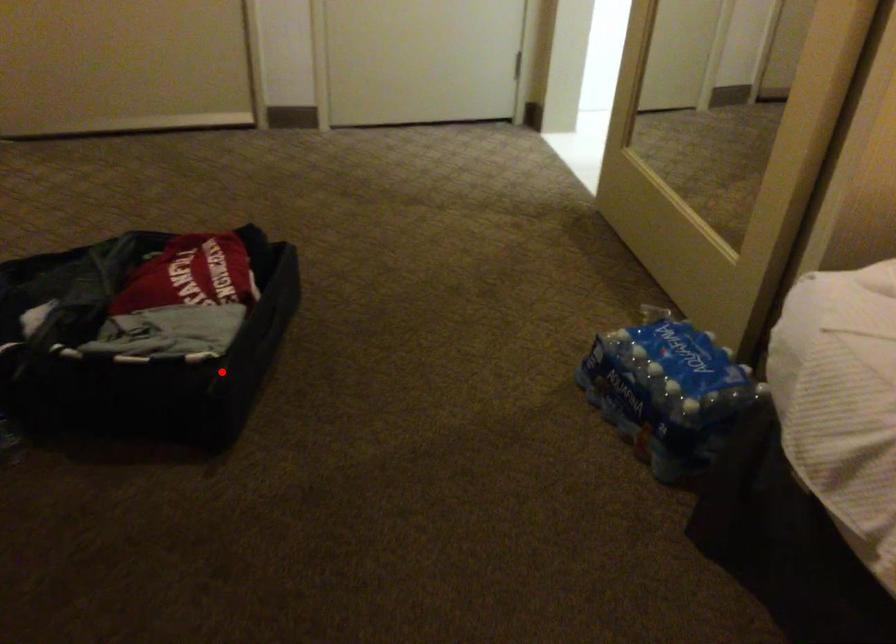
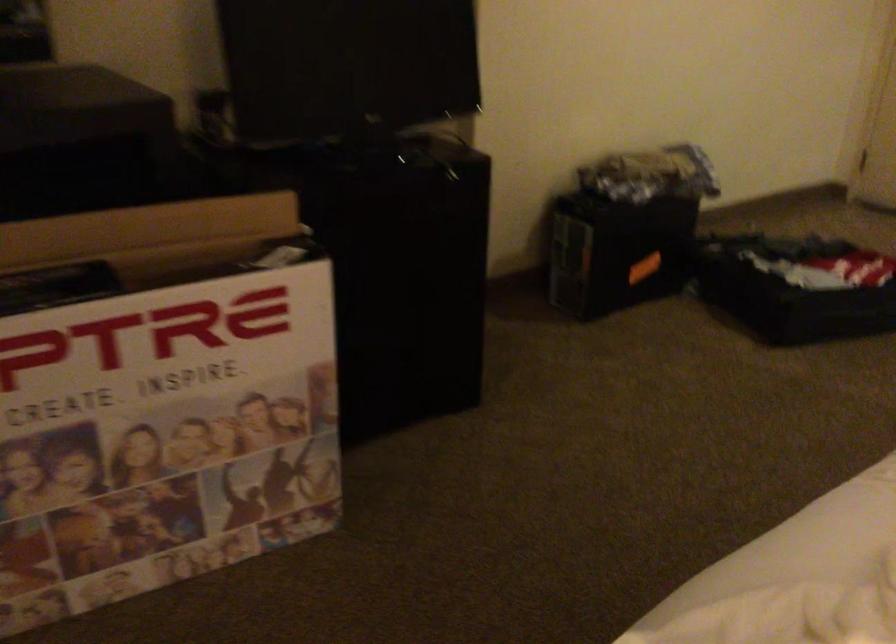
In the second image, find the point that corresponds to the highlighted location in the first image.

(794, 287)